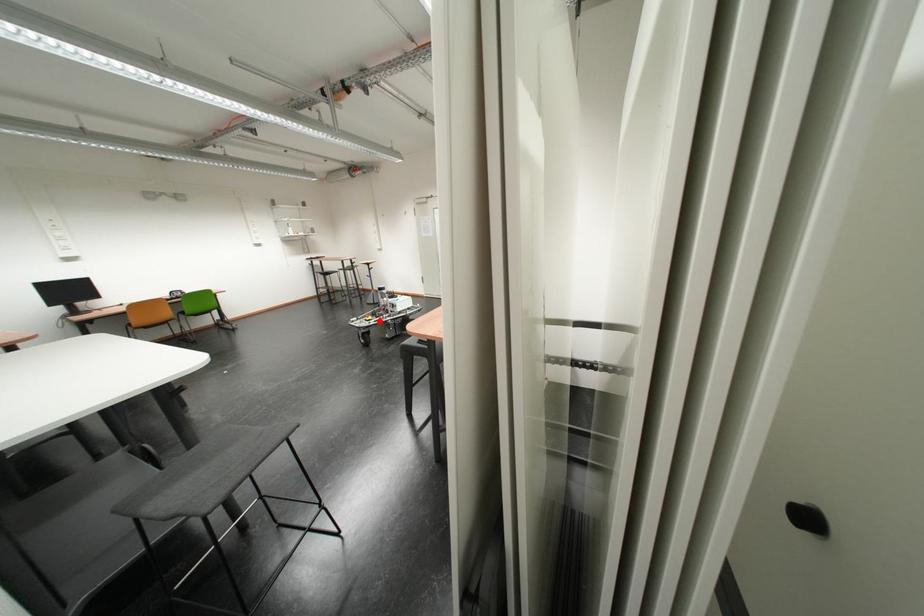
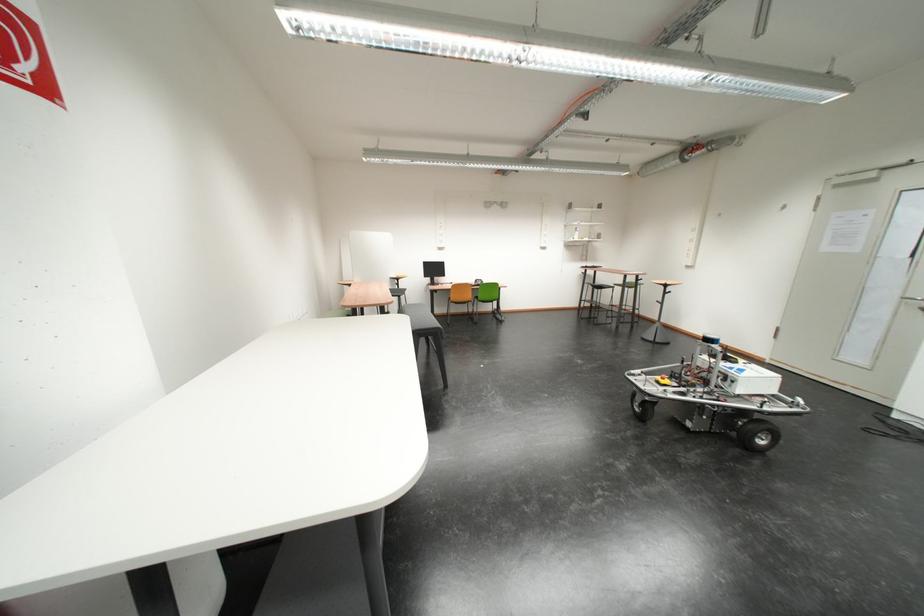
Find the pixel in the second image that matches the highlighted location in the first image.

(674, 384)